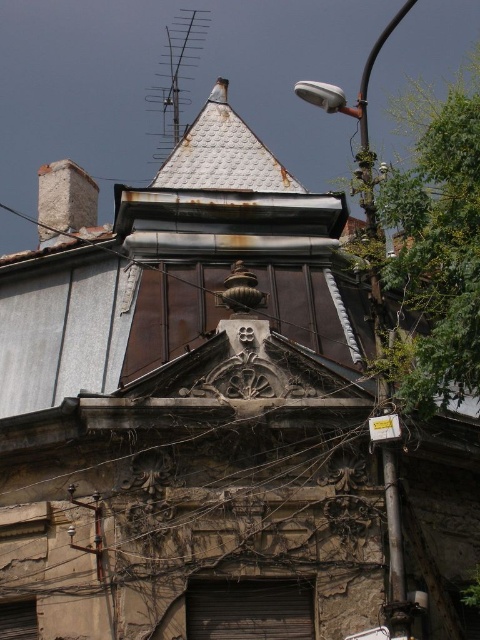
You are standing in front of the old building and notice both the green leafy tree at upper right and the rusty brick chimney at upper left. Which object appears closer to you from your vantage point?

The green leafy tree at upper right appears closer because it is positioned in front of the rusty brick chimney at upper left.

You are an architect assessing the building facade. You notice the green leafy tree at upper right and the rusty brick chimney at upper left. Which object occupies more horizontal space on the facade?

The green leafy tree at upper right might be wider than the rusty brick chimney at upper left.